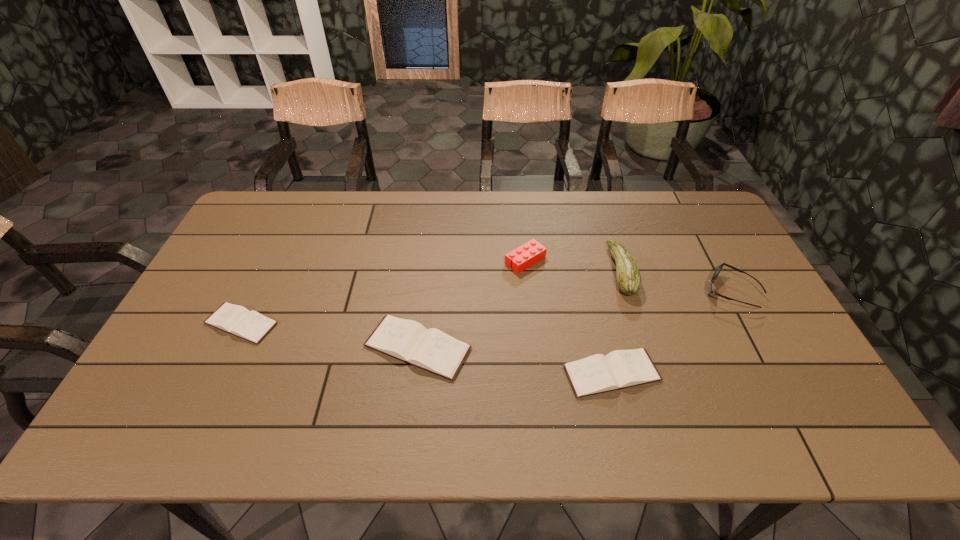
This screenshot has width=960, height=540. What are the coordinates of `empty space between the leftmost object and the rightmost object` in the screenshot? It's located at (486, 308).

Find the location of a particular element. This screenshot has height=540, width=960. empty location between the third object from left to right and the shortest diary is located at coordinates (383, 292).

This screenshot has height=540, width=960. Identify the location of vacant area between the second tallest diary and the fourth object from right to left. (568, 317).

I want to click on free space that is in between the second diary from left to right and the second shortest diary, so click(515, 360).

At what (x,y) coordinates should I click in order to perform the action: click on the fourth closest object relative to the rightmost object. Please return your answer as a coordinate pair (x, y). Looking at the image, I should click on (409, 341).

You are a GUI agent. You are given a task and a screenshot of the screen. Output one action in this format:
    pyautogui.click(x=<x>, y=<y>)
    Task: Click on the object that is the nearest to the sunglasses
    The image size is (960, 540).
    Given the screenshot: What is the action you would take?
    pyautogui.click(x=629, y=281)

Choose which diary is the nearest neighbor to the second diary from right to left. Please provide its 2D coordinates. Your answer should be formatted as a tuple, i.e. [(x, y)], where the tuple contains the x and y coordinates of a point satisfying the conditions above.

[(619, 369)]

Find the location of a particular element. the closest diary to the second tallest diary is located at coordinates (409, 341).

Where is `free space that satisfies the following two spatial constraints: 1. on the front side of the leftmost diary; 2. on the left side of the fifth object from right to left`? The image size is (960, 540). free space that satisfies the following two spatial constraints: 1. on the front side of the leftmost diary; 2. on the left side of the fifth object from right to left is located at coordinates (230, 347).

The height and width of the screenshot is (540, 960). I want to click on vacant space that satisfies the following two spatial constraints: 1. on the front side of the second shortest object; 2. on the left side of the leftmost diary, so click(218, 373).